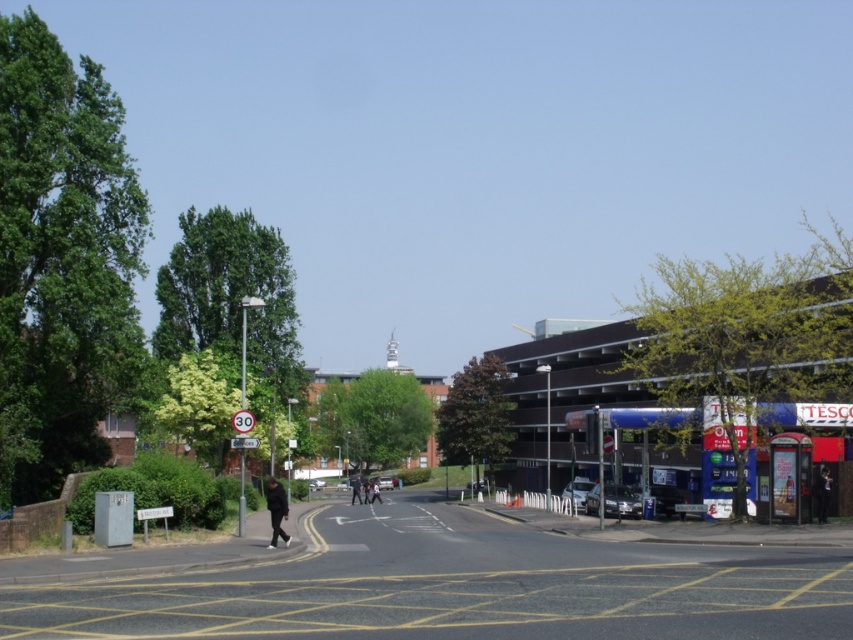
Question: Estimate the real-world distances between objects in this image. Which object is farther from the black matte person at center?

Choices:
 (A) black matte jacket at center
 (B) dark blue jacket at lower left

Answer: (A)

Question: Among these points, which one is farthest from the camera?

Choices:
 (A) (282, 512)
 (B) (827, 496)

Answer: (B)

Question: In this image, where is black matte jacket at center located relative to black matte person at center?

Choices:
 (A) below
 (B) above

Answer: (B)

Question: Which is nearer to the white plastic sign at left?

Choices:
 (A) black matte person at center
 (B) dark blue jacket at lower left
 (C) black matte jacket at center

Answer: (B)

Question: Is white plastic sign at left below black matte person at center?

Choices:
 (A) yes
 (B) no

Answer: (B)

Question: Is dark blue jacket at lower left below black matte jacket at center?

Choices:
 (A) yes
 (B) no

Answer: (A)